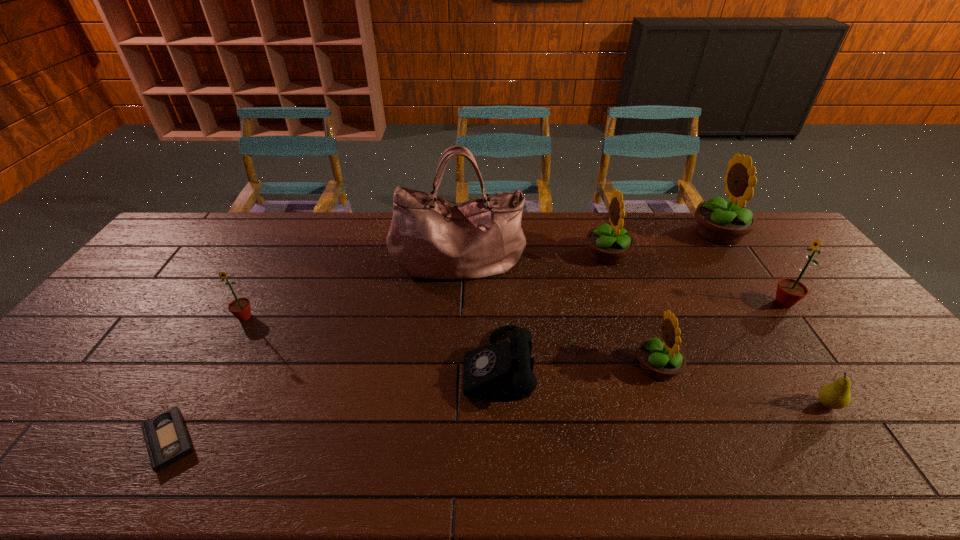
Identify the location of object that is the eighth closest to the leftmost sunflower. (789, 291).

I want to click on sunflower that is the third nearest to the second biggest yellow sunflower, so click(789, 291).

Locate an element on the screen. This screenshot has height=540, width=960. sunflower that is the fifth nearest to the handbag is located at coordinates (789, 291).

This screenshot has height=540, width=960. I want to click on yellow sunflower that is the closest to the second biggest yellow sunflower, so click(720, 221).

Image resolution: width=960 pixels, height=540 pixels. What are the coordinates of `the third closest yellow sunflower to the smaller green sunflower` in the screenshot? It's located at (720, 221).

In order to click on free space that satisfies the following two spatial constraints: 1. on the face of the bigger green sunflower; 2. on the front side of the shortest object in this screenshot , I will do (884, 440).

You are a GUI agent. You are given a task and a screenshot of the screen. Output one action in this format:
    pyautogui.click(x=<x>, y=<y>)
    Task: Click on the free region that satisfies the following two spatial constraints: 1. on the face of the second biggest yellow sunflower; 2. on the back side of the pear
    This screenshot has width=960, height=540.
    Given the screenshot: What is the action you would take?
    pyautogui.click(x=660, y=404)

I want to click on free space in the image that satisfies the following two spatial constraints: 1. on the dial of the pear; 2. on the right side of the telephone, so click(499, 404).

This screenshot has width=960, height=540. What are the coordinates of `vacant area in the image that satisfies the following two spatial constraints: 1. on the face of the right green sunflower; 2. on the front side of the pear` in the screenshot? It's located at point(857,404).

You are a GUI agent. You are given a task and a screenshot of the screen. Output one action in this format:
    pyautogui.click(x=<x>, y=<y>)
    Task: Click on the vacant area in the image that satisfies the following two spatial constraints: 1. on the face of the pear; 2. on the right side of the nearest sunflower
    This screenshot has height=540, width=960.
    Given the screenshot: What is the action you would take?
    pyautogui.click(x=671, y=404)